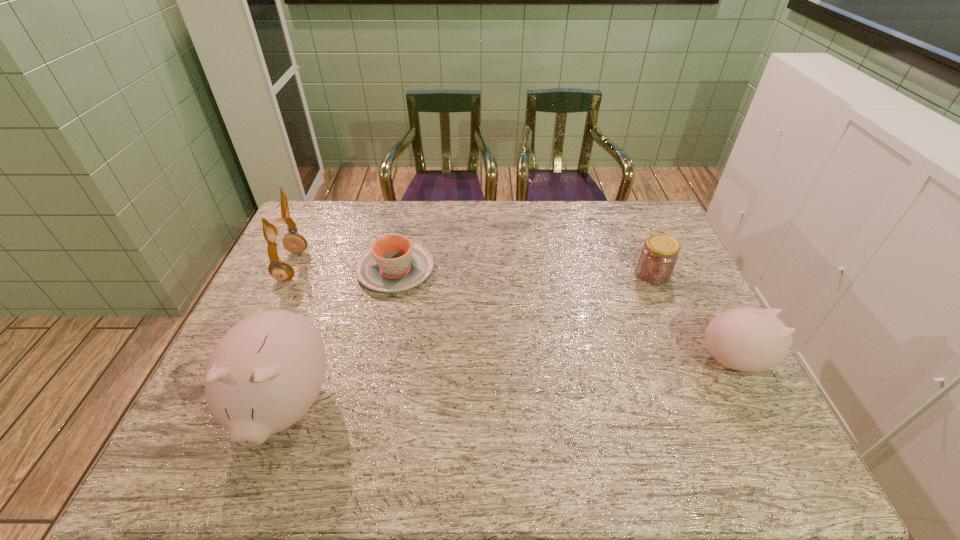
Please point a space for a new piggy_bank to maintain equal intervals. Please provide its 2D coordinates. Your answer should be formatted as a tuple, i.e. [(x, y)], where the tuple contains the x and y coordinates of a point satisfying the conditions above.

[(521, 382)]